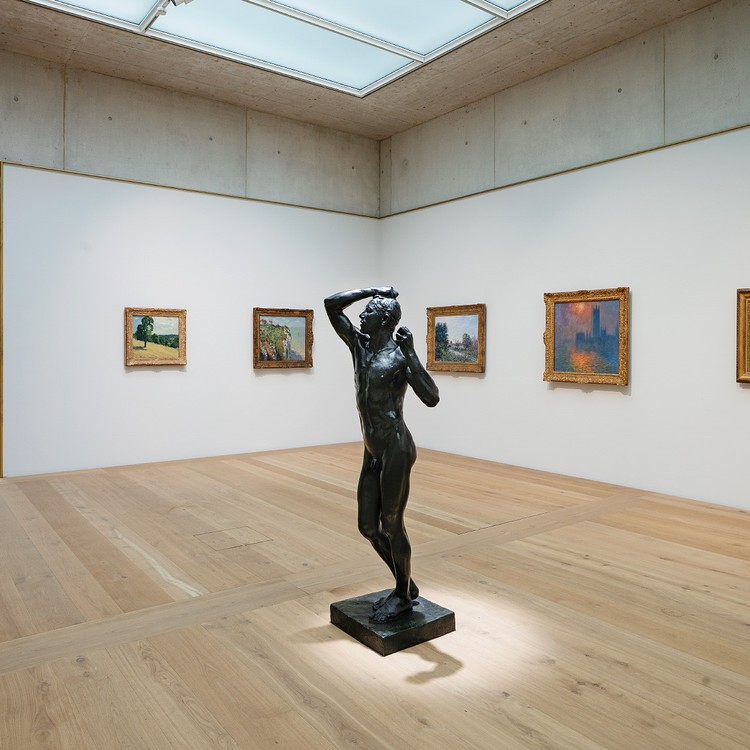
Where is `framed art`? The width and height of the screenshot is (750, 750). framed art is located at coordinates (154, 327), (268, 328), (462, 339), (564, 333), (742, 343).